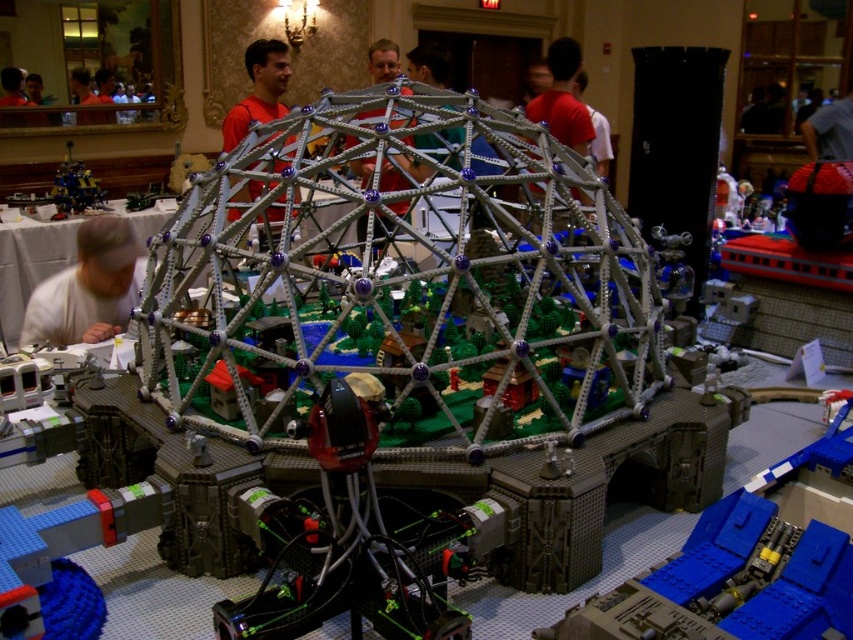
Does orange shirt at center have a larger size compared to metallic blue robot at left?

Actually, orange shirt at center might be smaller than metallic blue robot at left.

How distant is orange shirt at center from metallic blue robot at left?

They are 3.55 feet apart.

Is point (251, 180) positioned before point (73, 176)?

Yes, it is in front of point (73, 176).

You are a GUI agent. You are given a task and a screenshot of the screen. Output one action in this format:
    pyautogui.click(x=<x>, y=<y>)
    Task: Click on the orange shirt at center
    
    Given the screenshot: What is the action you would take?
    click(258, 90)

Which is more to the left, white matte shirt at lower left or orange shirt at center?

From the viewer's perspective, white matte shirt at lower left appears more on the left side.

Which is behind, point (68, 298) or point (242, 202)?

The point (242, 202) is behind.

Describe the element at coordinates (88, 288) in the screenshot. I see `white matte shirt at lower left` at that location.

Image resolution: width=853 pixels, height=640 pixels. In order to click on white matte shirt at lower left in this screenshot , I will do `click(88, 288)`.

Does white matte shirt at lower left appear on the right side of metallic blue robot at left?

Indeed, white matte shirt at lower left is positioned on the right side of metallic blue robot at left.

Where is `white matte shirt at lower left`? Image resolution: width=853 pixels, height=640 pixels. white matte shirt at lower left is located at coordinates [88, 288].